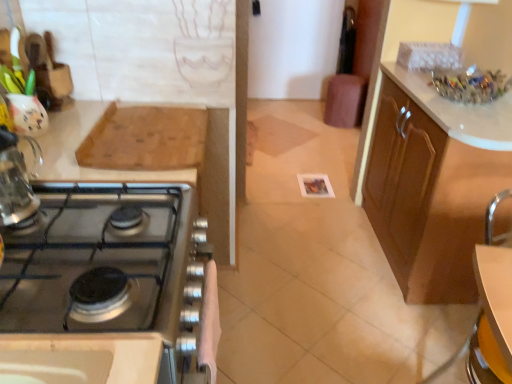
At what (x,y) coordinates should I click in order to perform the action: click on free space on the front side of brown wood cabinet at right, positioned as the 2th cabinetry in front-to-back order. Please return your answer as a coordinate pair (x, y). This screenshot has width=512, height=384. Looking at the image, I should click on (387, 337).